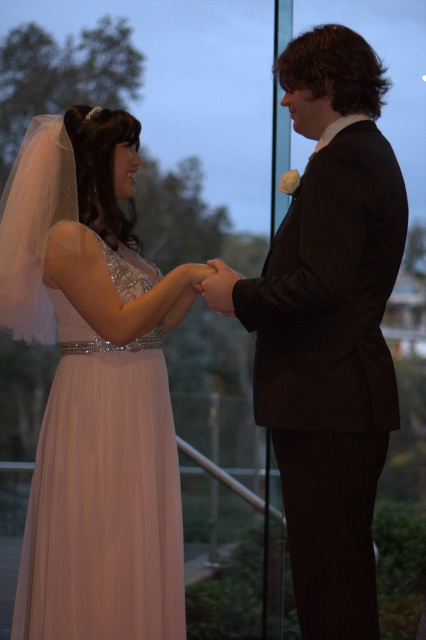
Does satin pink dress at left lie in front of black satin suit at center?

No, it is not.

Can you confirm if satin pink dress at left is smaller than black satin suit at center?

Incorrect, satin pink dress at left is not smaller in size than black satin suit at center.

This screenshot has height=640, width=426. What do you see at coordinates (94, 387) in the screenshot?
I see `satin pink dress at left` at bounding box center [94, 387].

Find the location of a particular element. The height and width of the screenshot is (640, 426). satin pink dress at left is located at coordinates (94, 387).